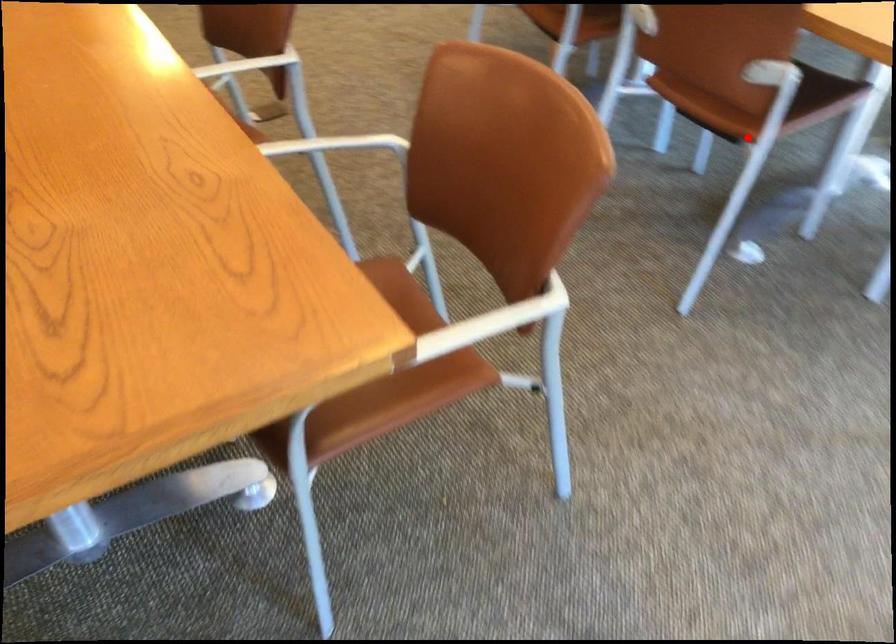
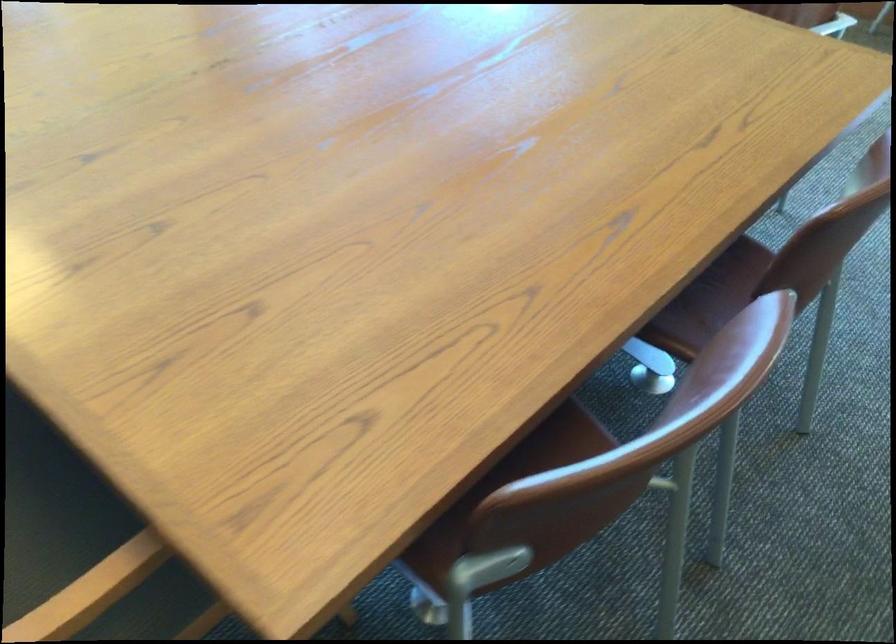
Question: I am providing you with two images of the same scene from different viewpoints. Image1 has a red point marked. In image2, the corresponding 3D location appears at what relative position? Reply with the corresponding letter.

Choices:
 (A) Closer
 (B) Farther

Answer: (A)